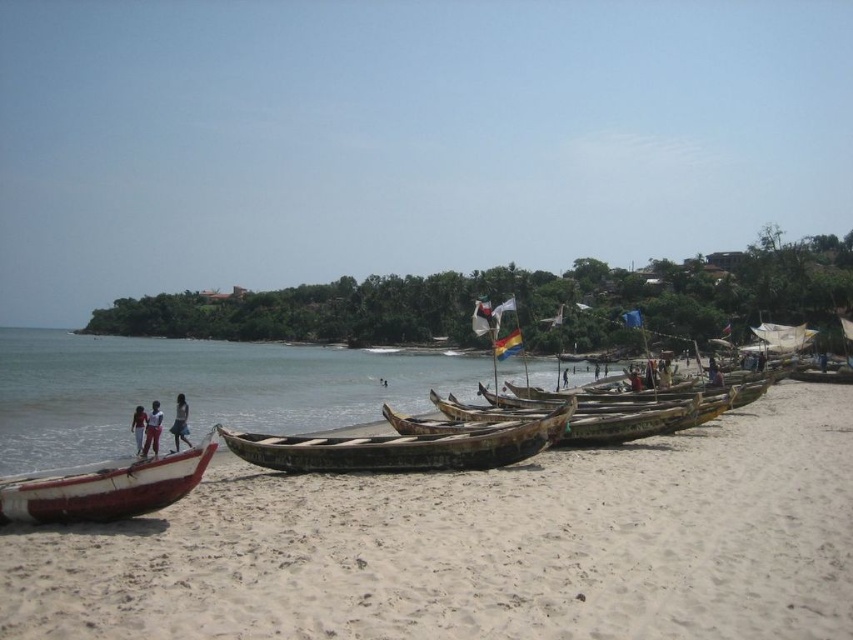
Who is higher up, white sandy beach at lower left or blue denim skirt at lower left?

blue denim skirt at lower left is higher up.

Measure the distance between white sandy beach at lower left and blue denim skirt at lower left.

white sandy beach at lower left and blue denim skirt at lower left are 109.47 feet apart from each other.

I want to click on white sandy beach at lower left, so click(480, 547).

Is white sandy beach at lower left shorter than white fabric pants at lower left?

Indeed, white sandy beach at lower left has a lesser height compared to white fabric pants at lower left.

At what (x,y) coordinates should I click in order to perform the action: click on white sandy beach at lower left. Please return your answer as a coordinate pair (x, y). The width and height of the screenshot is (853, 640). Looking at the image, I should click on (480, 547).

Who is shorter, white sandy beach at lower left or rusty wooden canoe at center?

Standing shorter between the two is rusty wooden canoe at center.

What do you see at coordinates (480, 547) in the screenshot?
I see `white sandy beach at lower left` at bounding box center [480, 547].

Find the location of `white sandy beach at lower left`. white sandy beach at lower left is located at coordinates (480, 547).